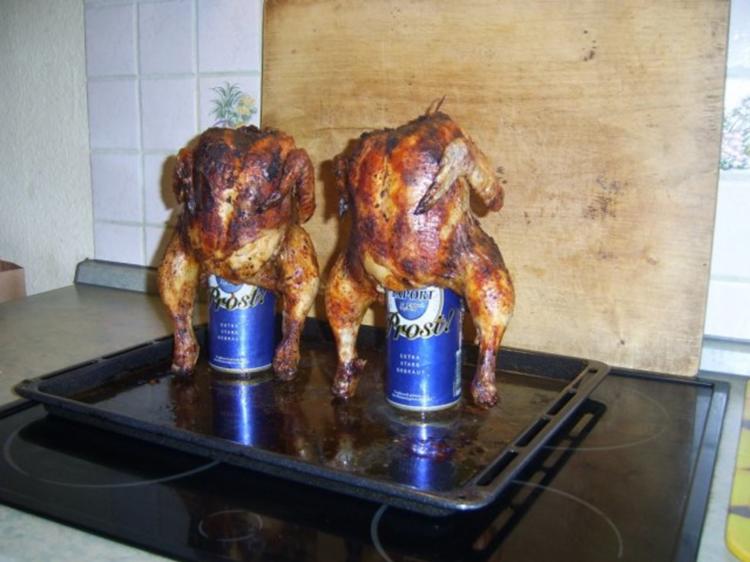
Where is `tile`? tile is located at coordinates (92, 140).